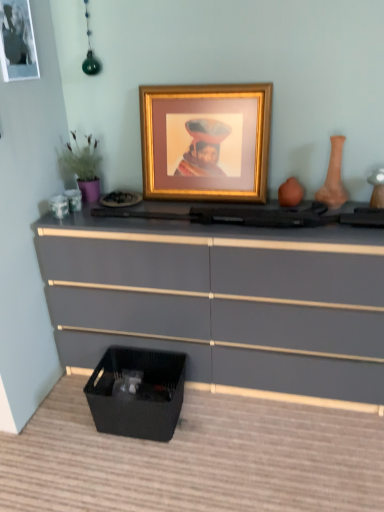
Question: In terms of width, does matte gray chest of drawers at lower center look wider or thinner when compared to terracotta clay vase at right?

Choices:
 (A) thin
 (B) wide

Answer: (B)

Question: In terms of height, does matte gray chest of drawers at lower center look taller or shorter compared to terracotta clay vase at right?

Choices:
 (A) short
 (B) tall

Answer: (B)

Question: Estimate the real-world distances between objects in this image. Which object is closer to the gold metallic picture frame at center, acting as the 1th picture frame starting from the right?

Choices:
 (A) metallic gold picture frame at upper left, the 1th picture frame positioned from the left
 (B) matte gray chest of drawers at lower center
 (C) terracotta clay vase at right
 (D) black woven basket at lower left
 (E) green matte plant at left

Answer: (E)

Question: Which of these objects is positioned closest to the gold metallic picture frame at center, marked as the 2th picture frame in a left-to-right arrangement?

Choices:
 (A) black woven basket at lower left
 (B) green matte plant at left
 (C) terracotta clay vase at right
 (D) matte gray chest of drawers at lower center
 (E) metallic gold picture frame at upper left, which ranks as the 2th picture frame in right-to-left order

Answer: (B)